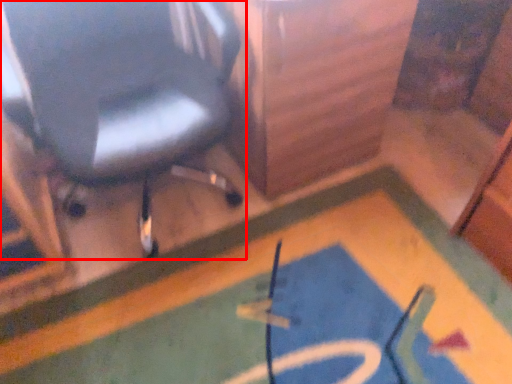
Question: From the image, what is the correct spatial relationship of chair (annotated by the red box) in relation to bath mat?

Choices:
 (A) left
 (B) right

Answer: (A)